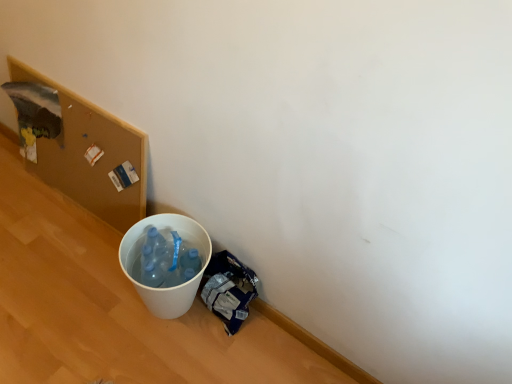
Where is `wooden corkboard at upper left`? The image size is (512, 384). wooden corkboard at upper left is located at coordinates (84, 152).

Where is `white plastic bucket at lower left`? The width and height of the screenshot is (512, 384). white plastic bucket at lower left is located at coordinates (172, 287).

Image resolution: width=512 pixels, height=384 pixels. Find the location of `wooden corkboard at upper left`. wooden corkboard at upper left is located at coordinates (84, 152).

Is white plastic bucket at lower left at the back of wooden corkboard at upper left?

No.

Between wooden corkboard at upper left and white plastic bucket at lower left, which one has larger size?

wooden corkboard at upper left is bigger.

Which is correct: wooden corkboard at upper left is inside white plastic bucket at lower left, or outside of it?

wooden corkboard at upper left cannot be found inside white plastic bucket at lower left.

Locate an element on the screen. cardboard box lying on the left of white plastic bucket at lower left is located at coordinates (84, 152).

Between white plastic bucket at lower left and blue plastic bag at lower right, which one is positioned in front?

Positioned in front is white plastic bucket at lower left.

Which is more to the left, white plastic bucket at lower left or blue plastic bag at lower right?

white plastic bucket at lower left.

From a real-world perspective, is white plastic bucket at lower left positioned above or below blue plastic bag at lower right?

From a real-world perspective, white plastic bucket at lower left is physically above blue plastic bag at lower right.

What's the angular difference between white plastic bucket at lower left and blue plastic bag at lower right's facing directions?

0.731 degrees separate the facing orientations of white plastic bucket at lower left and blue plastic bag at lower right.

Find the location of a particular element. The height and width of the screenshot is (384, 512). garbage on the right of the wooden corkboard at upper left is located at coordinates (229, 289).

Is blue plastic bag at lower right looking in the opposite direction of wooden corkboard at upper left?

blue plastic bag at lower right does not have its back to wooden corkboard at upper left.

Can you tell me how much blue plastic bag at lower right and wooden corkboard at upper left differ in facing direction?

0.731 degrees separate the facing orientations of blue plastic bag at lower right and wooden corkboard at upper left.

Would you say blue plastic bag at lower right is inside or outside wooden corkboard at upper left?

blue plastic bag at lower right is outside wooden corkboard at upper left.

From their relative heights in the image, would you say wooden corkboard at upper left is taller or shorter than blue plastic bag at lower right?

wooden corkboard at upper left is taller than blue plastic bag at lower right.

Which is farther, (135, 194) or (236, 264)?

The point (135, 194) is more distant.

Based on the photo, is wooden corkboard at upper left beside blue plastic bag at lower right?

No, wooden corkboard at upper left is not with blue plastic bag at lower right.

How different are the orientations of blue plastic bag at lower right and white plastic bucket at lower left in degrees?

The facing directions of blue plastic bag at lower right and white plastic bucket at lower left are 0.731 degrees apart.

Does blue plastic bag at lower right have a lesser height compared to white plastic bucket at lower left?

Yes.

Considering the points (239, 325) and (189, 239), which point is behind, point (239, 325) or point (189, 239)?

The point (239, 325) is more distant.

Does blue plastic bag at lower right appear on the left side of white plastic bucket at lower left?

No.

Between point (181, 233) and point (132, 147), which one is positioned in front?

The point (181, 233) is closer to the camera.

Can you confirm if white plastic bucket at lower left is positioned to the right of wooden corkboard at upper left?

Indeed, white plastic bucket at lower left is positioned on the right side of wooden corkboard at upper left.

From a real-world perspective, who is located lower, white plastic bucket at lower left or wooden corkboard at upper left?

white plastic bucket at lower left is physically lower.

At what (x,y) coordinates should I click in order to perform the action: click on waste container in front of the wooden corkboard at upper left. Please return your answer as a coordinate pair (x, y). This screenshot has width=512, height=384. Looking at the image, I should click on (172, 287).

I want to click on garbage behind the white plastic bucket at lower left, so click(229, 289).

Considering their positions, is white plastic bucket at lower left positioned closer to wooden corkboard at upper left than blue plastic bag at lower right?

Among the two, white plastic bucket at lower left is located nearer to wooden corkboard at upper left.

Estimate the real-world distances between objects in this image. Which object is further from blue plastic bag at lower right, white plastic bucket at lower left or wooden corkboard at upper left?

Among the two, wooden corkboard at upper left is located further to blue plastic bag at lower right.

Based on their spatial positions, is wooden corkboard at upper left or white plastic bucket at lower left closer to blue plastic bag at lower right?

Among the two, white plastic bucket at lower left is located nearer to blue plastic bag at lower right.

When comparing their distances from white plastic bucket at lower left, does blue plastic bag at lower right or wooden corkboard at upper left seem further?

wooden corkboard at upper left is positioned further to the anchor white plastic bucket at lower left.

Estimate the real-world distances between objects in this image. Which object is further from wooden corkboard at upper left, blue plastic bag at lower right or white plastic bucket at lower left?

Among the two, blue plastic bag at lower right is located further to wooden corkboard at upper left.

When comparing their distances from white plastic bucket at lower left, does wooden corkboard at upper left or blue plastic bag at lower right seem further?

The object further to white plastic bucket at lower left is wooden corkboard at upper left.

The width and height of the screenshot is (512, 384). What are the coordinates of `waste container between wooden corkboard at upper left and blue plastic bag at lower right from left to right` in the screenshot? It's located at (172, 287).